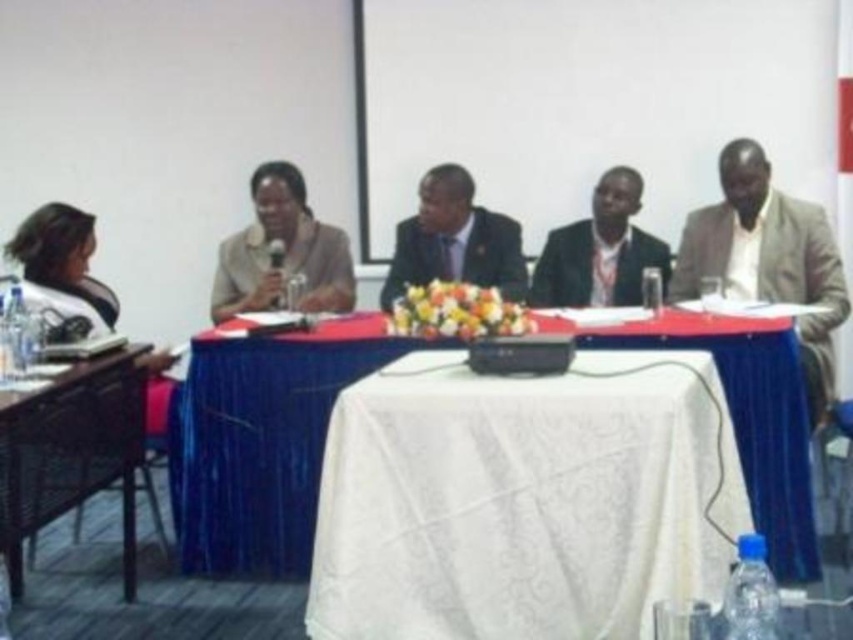
Question: Does white lace tablecloth at center appear on the right side of shiny black suit at center?

Choices:
 (A) no
 (B) yes

Answer: (B)

Question: Does white lace tablecloth at center have a larger size compared to shiny black suit at center?

Choices:
 (A) no
 (B) yes

Answer: (B)

Question: Which point is farther to the camera?

Choices:
 (A) white fabric table at lower left
 (B) matte beige jacket at center

Answer: (B)

Question: Which point is closer to the camera taking this photo?

Choices:
 (A) (444, 248)
 (B) (91, 476)

Answer: (B)

Question: Based on their relative distances, which object is nearer to the white lace tablecloth at center?

Choices:
 (A) white fabric table at lower left
 (B) matte beige suit at right

Answer: (B)

Question: Where is matte beige jacket at center located in relation to shiny black suit at center in the image?

Choices:
 (A) above
 (B) below

Answer: (A)